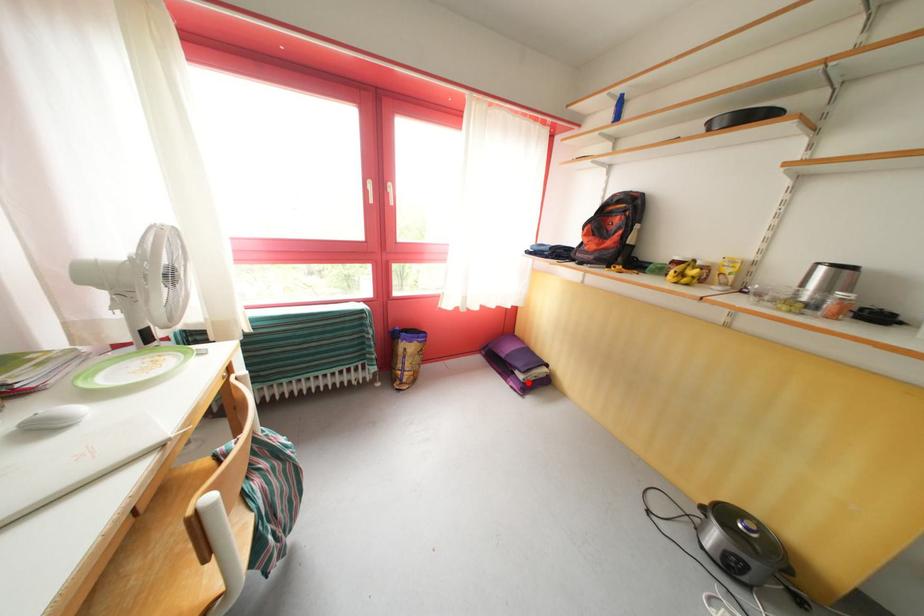
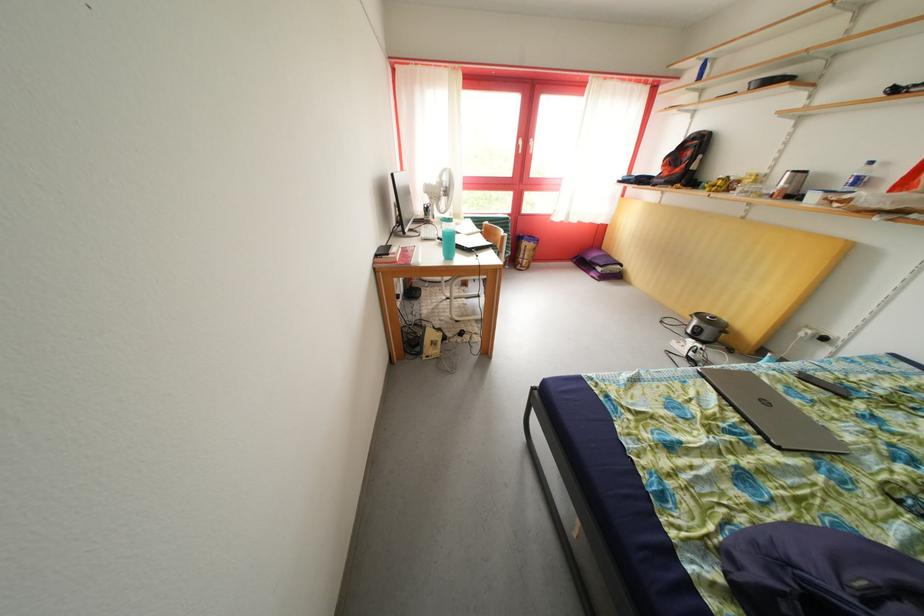
The point at the highlighted location is marked in the first image. Where is the corresponding point in the second image?

(608, 275)